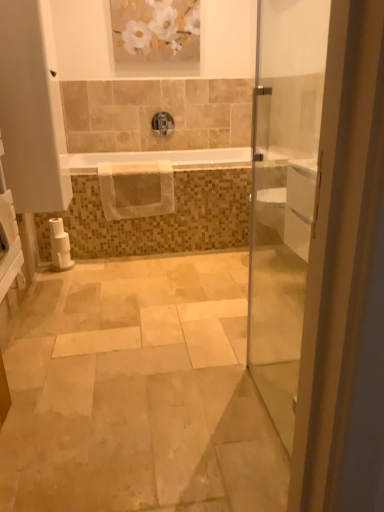
You are a GUI agent. You are given a task and a screenshot of the screen. Output one action in this format:
    pyautogui.click(x=<x>, y=<y>)
    Task: Click on the free space in front of white glossy door at right
    The height and width of the screenshot is (512, 384).
    Given the screenshot: What is the action you would take?
    pyautogui.click(x=250, y=459)